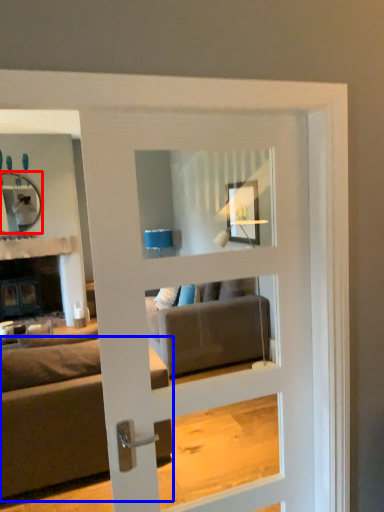
Question: Which object appears closest to the camera in this image, mirror (highlighted by a red box) or studio couch (highlighted by a blue box)?

Choices:
 (A) mirror
 (B) studio couch

Answer: (B)